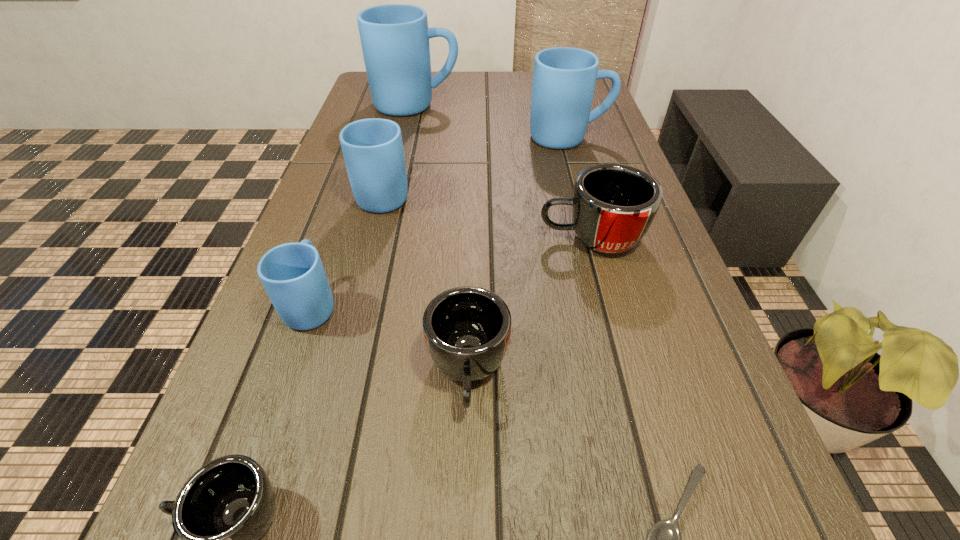
The height and width of the screenshot is (540, 960). Identify the location of the tallest mug. (395, 38).

Identify the location of the tallest object. (395, 38).

Find the location of a particular element. The image size is (960, 540). the second farthest object is located at coordinates (564, 78).

The height and width of the screenshot is (540, 960). I want to click on the seventh shortest object, so click(x=564, y=78).

Where is `the fifth shortest mug`? The height and width of the screenshot is (540, 960). the fifth shortest mug is located at coordinates (372, 148).

I want to click on the second smallest blue mug, so click(372, 148).

Locate an element on the screen. The width and height of the screenshot is (960, 540). the biggest red mug is located at coordinates (613, 205).

Find the location of a particular element. This screenshot has height=540, width=960. the farthest red mug is located at coordinates (613, 205).

The image size is (960, 540). In order to click on the smallest blue mug in this screenshot , I will do `click(293, 275)`.

Locate an element on the screen. The width and height of the screenshot is (960, 540). the second farthest red mug is located at coordinates (467, 329).